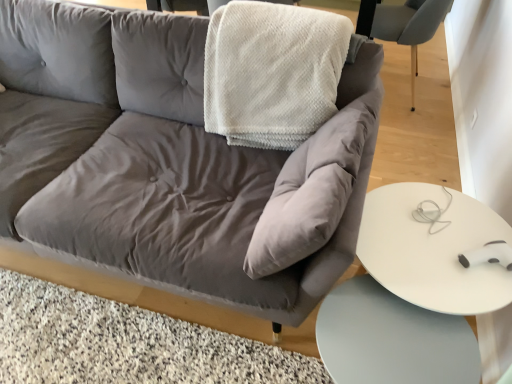
This screenshot has width=512, height=384. What do you see at coordinates (164, 159) in the screenshot?
I see `velvet gray couch at center` at bounding box center [164, 159].

Find the location of `white textured blanket at upper center`. white textured blanket at upper center is located at coordinates (272, 72).

Locate an element on the screen. white glossy table at lower right, marked as the 1th table in a bottom-to-top arrangement is located at coordinates (392, 339).

Identify the location of velvet gray couch at center. The image size is (512, 384). (164, 159).

Are velvet gray couch at center and white glossy table at lower right, marked as the 1th table in a bottom-to-top arrangement, making contact?

velvet gray couch at center is not next to white glossy table at lower right, marked as the 1th table in a bottom-to-top arrangement, and they're not touching.

How different are the orientations of velvet gray couch at center and white glossy table at lower right, marked as the 1th table in a bottom-to-top arrangement, in degrees?

They differ by 7.08e-05 degrees in their facing directions.

Is velvet gray couch at center oriented away from white glossy table at lower right, marked as the 1th table in a bottom-to-top arrangement?

No, white glossy table at lower right, marked as the 1th table in a bottom-to-top arrangement, is not at the back of velvet gray couch at center.

Can you confirm if velvet gray couch at center is shorter than white glossy table at lower right, the second table in the top-to-bottom sequence?

Incorrect, the height of velvet gray couch at center does not fall short of that of white glossy table at lower right, the second table in the top-to-bottom sequence.

Is matte gray chair at upper right located outside velvet gray couch at center?

Absolutely, matte gray chair at upper right is external to velvet gray couch at center.

Is matte gray chair at upper right positioned behind velvet gray couch at center?

That is True.

Is matte gray chair at upper right taller than velvet gray couch at center?

In fact, matte gray chair at upper right may be shorter than velvet gray couch at center.

How many degrees apart are the facing directions of matte gray chair at upper right and velvet gray couch at center?

They differ by 91.9 degrees in their facing directions.

Which of these two, white glossy table at lower right, the second table in the top-to-bottom sequence, or white glossy table at lower right, marked as the first table in a top-to-bottom arrangement, is wider?

white glossy table at lower right, marked as the first table in a top-to-bottom arrangement.

Is point (420, 348) positioned behind point (459, 240)?

No, (420, 348) is in front of (459, 240).

Find the location of a particular element. table located on the right of white glossy table at lower right, marked as the 1th table in a bottom-to-top arrangement is located at coordinates (433, 248).

From the image's perspective, is white glossy table at lower right, the second table in the top-to-bottom sequence, above white glossy table at lower right, marked as the first table in a top-to-bottom arrangement?

No, from the image's perspective, white glossy table at lower right, the second table in the top-to-bottom sequence, is not above white glossy table at lower right, marked as the first table in a top-to-bottom arrangement.

Is white textured blanket at upper center wider or thinner than matte gray chair at upper right?

Considering their sizes, white textured blanket at upper center looks broader than matte gray chair at upper right.

Is white textured blanket at upper center oriented away from matte gray chair at upper right?

That's right, white textured blanket at upper center is facing away from matte gray chair at upper right.

Is white textured blanket at upper center taller or shorter than matte gray chair at upper right?

Clearly, white textured blanket at upper center is shorter compared to matte gray chair at upper right.

At what (x,y) coordinates should I click in order to perform the action: click on blanket to the left of white glossy table at lower right, marked as the first table in a top-to-bottom arrangement. Please return your answer as a coordinate pair (x, y). Image resolution: width=512 pixels, height=384 pixels. Looking at the image, I should click on (272, 72).

Is white textured blanket at upper center situated inside white glossy table at lower right, marked as the first table in a top-to-bottom arrangement, or outside?

white textured blanket at upper center is spatially situated outside white glossy table at lower right, marked as the first table in a top-to-bottom arrangement.

Would you say white textured blanket at upper center is a long distance from white glossy table at lower right, the 2th table positioned from the bottom?

No, white textured blanket at upper center is not far from white glossy table at lower right, the 2th table positioned from the bottom.

Where is `studio couch in front of the matte gray chair at upper right`? The height and width of the screenshot is (384, 512). studio couch in front of the matte gray chair at upper right is located at coordinates (164, 159).

Between velvet gray couch at center and matte gray chair at upper right, which one has larger size?

velvet gray couch at center.

From a real-world perspective, who is located higher, velvet gray couch at center or matte gray chair at upper right?

velvet gray couch at center, from a real-world perspective.

Between velvet gray couch at center and matte gray chair at upper right, which one is positioned behind?

matte gray chair at upper right.

Consider the image. From the image's perspective, is velvet gray couch at center below white textured blanket at upper center?

Yes, from the image's perspective, velvet gray couch at center is below white textured blanket at upper center.

Considering the points (199, 103) and (282, 7), which point is in front, point (199, 103) or point (282, 7)?

The point (282, 7) is closer to the camera.

Can you tell me how much velvet gray couch at center and white textured blanket at upper center differ in facing direction?

There is a 4.4e-05-degree angle between the facing directions of velvet gray couch at center and white textured blanket at upper center.

You are a GUI agent. You are given a task and a screenshot of the screen. Output one action in this format:
    pyautogui.click(x=<x>, y=<y>)
    Task: Click on the studio couch above the white glossy table at lower right, the second table in the top-to-bottom sequence (from the image's perspective)
    This screenshot has height=384, width=512.
    Given the screenshot: What is the action you would take?
    pyautogui.click(x=164, y=159)

Identify the location of studio couch on the left of matte gray chair at upper right. The height and width of the screenshot is (384, 512). (164, 159).

Based on the photo, which object lies further to the anchor point white textured blanket at upper center, white glossy table at lower right, the second table in the top-to-bottom sequence, or velvet gray couch at center?

white glossy table at lower right, the second table in the top-to-bottom sequence, is positioned further to the anchor white textured blanket at upper center.

Based on their spatial positions, is white glossy table at lower right, marked as the 1th table in a bottom-to-top arrangement, or velvet gray couch at center closer to white glossy table at lower right, marked as the first table in a top-to-bottom arrangement?

white glossy table at lower right, marked as the 1th table in a bottom-to-top arrangement, is closer to white glossy table at lower right, marked as the first table in a top-to-bottom arrangement.

When comparing their distances from velvet gray couch at center, does matte gray chair at upper right or white glossy table at lower right, the 2th table positioned from the bottom, seem closer?

The object closer to velvet gray couch at center is white glossy table at lower right, the 2th table positioned from the bottom.

Considering their positions, is white textured blanket at upper center positioned closer to white glossy table at lower right, marked as the 1th table in a bottom-to-top arrangement, than matte gray chair at upper right?

The object closer to white glossy table at lower right, marked as the 1th table in a bottom-to-top arrangement, is white textured blanket at upper center.

Which object lies further to the anchor point velvet gray couch at center, white glossy table at lower right, the 2th table positioned from the bottom, or matte gray chair at upper right?

matte gray chair at upper right is positioned further to the anchor velvet gray couch at center.

Which object lies further to the anchor point velvet gray couch at center, white glossy table at lower right, the second table in the top-to-bottom sequence, or white glossy table at lower right, the 2th table positioned from the bottom?

Based on the image, white glossy table at lower right, the second table in the top-to-bottom sequence, appears to be further to velvet gray couch at center.

Based on their spatial positions, is matte gray chair at upper right or white textured blanket at upper center closer to white glossy table at lower right, marked as the first table in a top-to-bottom arrangement?

white textured blanket at upper center is closer to white glossy table at lower right, marked as the first table in a top-to-bottom arrangement.

Which object lies nearer to the anchor point matte gray chair at upper right, white textured blanket at upper center or white glossy table at lower right, the second table in the top-to-bottom sequence?

white textured blanket at upper center lies closer to matte gray chair at upper right than the other object.

Identify the location of blanket between matte gray chair at upper right and white glossy table at lower right, the second table in the top-to-bottom sequence, in the vertical direction. (272, 72).

Identify the location of table between matte gray chair at upper right and white glossy table at lower right, the second table in the top-to-bottom sequence, in the up-down direction. Image resolution: width=512 pixels, height=384 pixels. tap(433, 248).

You are a GUI agent. You are given a task and a screenshot of the screen. Output one action in this format:
    pyautogui.click(x=<x>, y=<y>)
    Task: Click on the blanket between matte gray chair at upper right and white glossy table at lower right, marked as the first table in a top-to-bottom arrangement, in the up-down direction
    Image resolution: width=512 pixels, height=384 pixels.
    Given the screenshot: What is the action you would take?
    pyautogui.click(x=272, y=72)

This screenshot has height=384, width=512. What are the coordinates of `blanket between velvet gray couch at center and white glossy table at lower right, the second table in the top-to-bottom sequence, in the horizontal direction` in the screenshot? It's located at (272, 72).